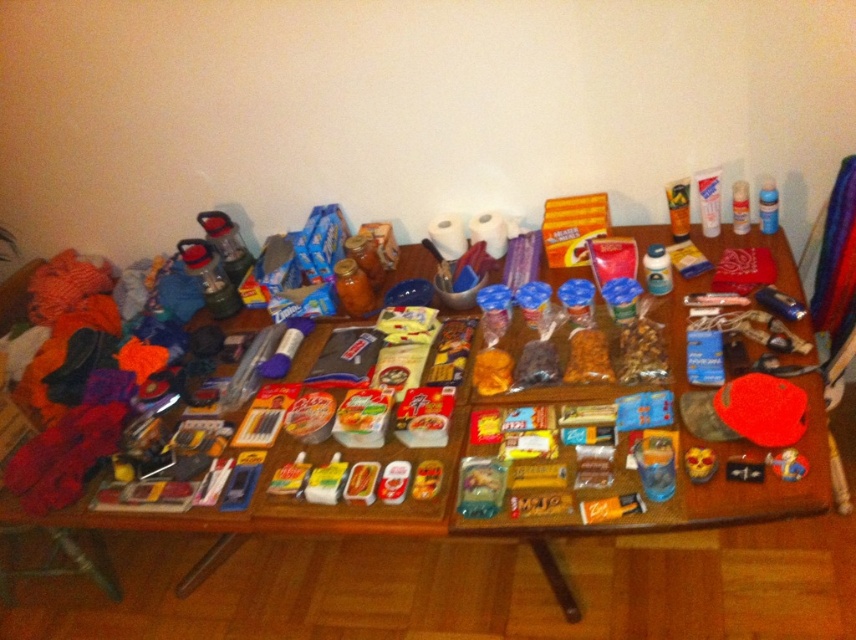
Is wooden table at center positioned in front of yellow matte mask at center?

That is False.

Can you confirm if wooden table at center is thinner than yellow matte mask at center?

No, wooden table at center is not thinner than yellow matte mask at center.

Identify the location of wooden table at center. This screenshot has height=640, width=856. tap(496, 529).

Is brown crumbly snack at center wider than yellow matte snack at center?

Yes.

Between brown crumbly snack at center and yellow matte snack at center, which one has less height?

Standing shorter between the two is yellow matte snack at center.

Does point (581, 352) come in front of point (491, 358)?

Yes, point (581, 352) is in front of point (491, 358).

Locate an element on the screen. The height and width of the screenshot is (640, 856). brown crumbly snack at center is located at coordinates (587, 356).

The width and height of the screenshot is (856, 640). What do you see at coordinates (587, 356) in the screenshot?
I see `brown crumbly snack at center` at bounding box center [587, 356].

Which of these two, brown crumbly snack at center or yellow matte mask at center, stands taller?

With more height is brown crumbly snack at center.

Is point (591, 362) positioned after point (706, 452)?

Yes, point (591, 362) is farther from viewer.

The width and height of the screenshot is (856, 640). In order to click on brown crumbly snack at center in this screenshot , I will do (x=587, y=356).